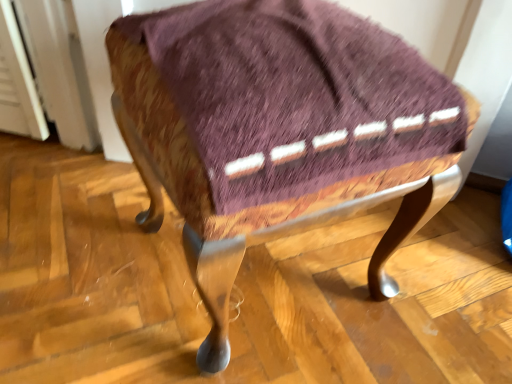
At what (x,y) coordinates should I click in order to perform the action: click on unoccupied region to the right of woven fabric stool at center. Please return your answer as a coordinate pair (x, y). The width and height of the screenshot is (512, 384). Looking at the image, I should click on (437, 276).